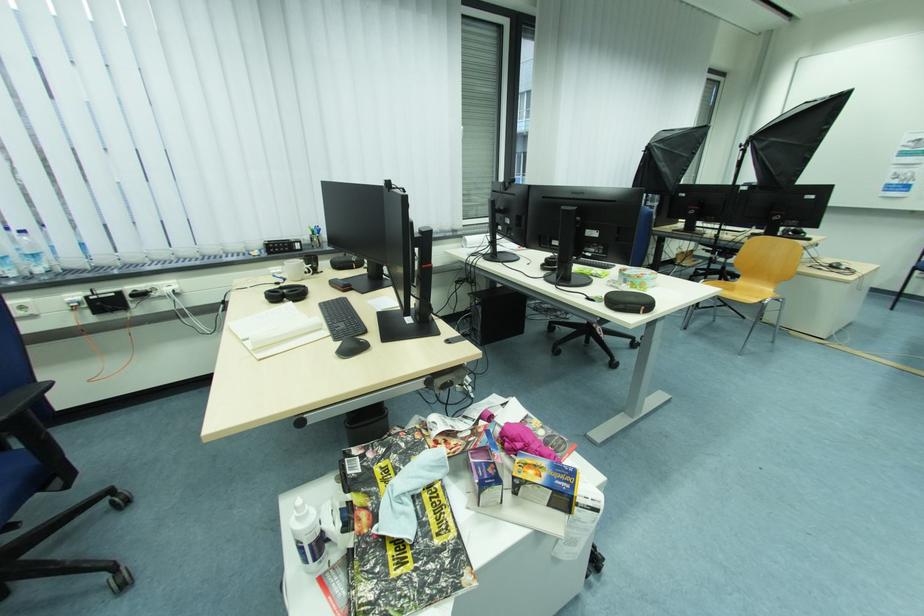
The width and height of the screenshot is (924, 616). I want to click on wooden chair sitting surface, so click(x=743, y=291).